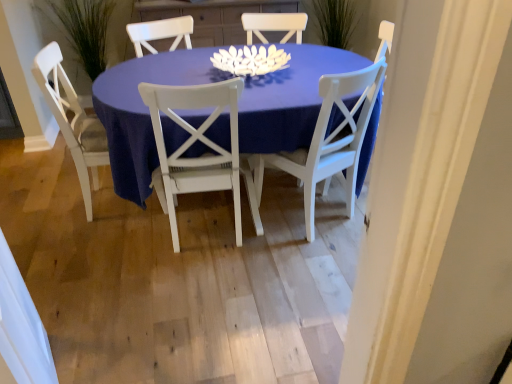
Question: Does white wood chair at left, which is counted as the third chair, starting from the right, have a larger size compared to matte white table at center?

Choices:
 (A) yes
 (B) no

Answer: (B)

Question: Can you confirm if white wood chair at left, which is counted as the third chair, starting from the right, is taller than matte white table at center?

Choices:
 (A) no
 (B) yes

Answer: (B)

Question: Is white wood chair at left, which is the first chair in left-to-right order, positioned before matte white table at center?

Choices:
 (A) no
 (B) yes

Answer: (A)

Question: Is white wood chair at left, which is counted as the third chair, starting from the right, not within matte white table at center?

Choices:
 (A) yes
 (B) no

Answer: (B)

Question: From the image's perspective, does white wood chair at left, which is the first chair in left-to-right order, appear higher than matte white table at center?

Choices:
 (A) yes
 (B) no

Answer: (B)

Question: Is white wood chair at left, which is counted as the third chair, starting from the right, in contact with matte white table at center?

Choices:
 (A) yes
 (B) no

Answer: (B)

Question: Considering the relative positions of white painted wood chair at center, the 1th chair in the right-to-left sequence, and green grass at left in the image provided, is white painted wood chair at center, the 1th chair in the right-to-left sequence, to the left of green grass at left from the viewer's perspective?

Choices:
 (A) yes
 (B) no

Answer: (B)

Question: Considering the relative sizes of white painted wood chair at center, positioned as the third chair in left-to-right order, and green grass at left in the image provided, is white painted wood chair at center, positioned as the third chair in left-to-right order, shorter than green grass at left?

Choices:
 (A) no
 (B) yes

Answer: (A)

Question: Is white painted wood chair at center, positioned as the third chair in left-to-right order, bigger than green grass at left?

Choices:
 (A) no
 (B) yes

Answer: (A)

Question: From the image's perspective, would you say white painted wood chair at center, positioned as the third chair in left-to-right order, is positioned over green grass at left?

Choices:
 (A) yes
 (B) no

Answer: (B)

Question: Would you say green grass at left is part of white painted wood chair at center, the 1th chair in the right-to-left sequence,'s contents?

Choices:
 (A) yes
 (B) no

Answer: (B)

Question: From a real-world perspective, is white painted wood chair at center, positioned as the third chair in left-to-right order, located beneath green grass at left?

Choices:
 (A) no
 (B) yes

Answer: (B)

Question: Is white wood chair at left, which is counted as the third chair, starting from the right, turned away from white wood chair at center, positioned as the 2th chair in right-to-left order?

Choices:
 (A) no
 (B) yes

Answer: (A)